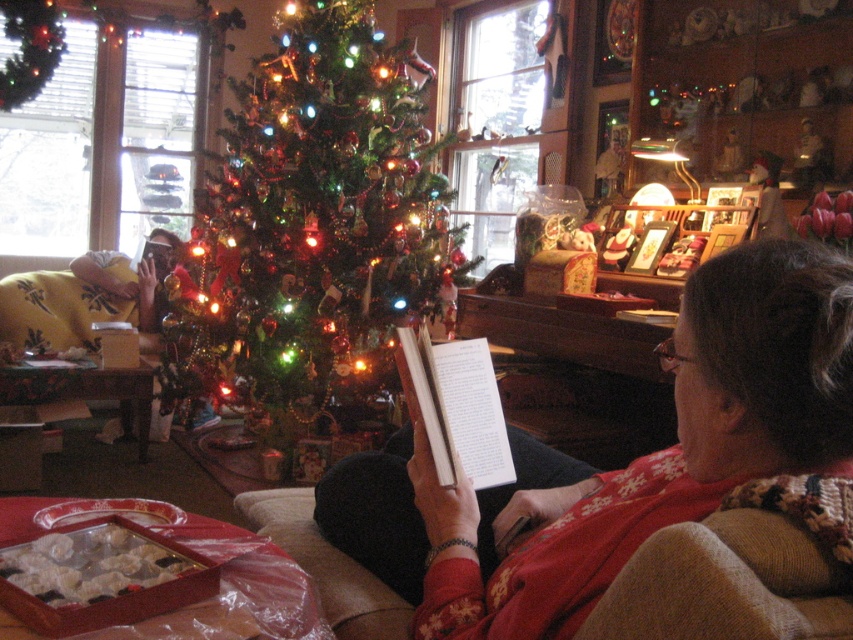
You are planning to place a 1.5 meter tall artificial tree in your living room. The space you have is exactly 1.5 meters tall. You see the shiny green christmas tree at center and the white paper book at center in the image. Based on their heights, can you determine if the artificial tree will fit in your space?

The shiny green christmas tree at center is taller than the white paper book at center. Since the artificial tree you want to place is 1.5 meters tall and the space is exactly 1.5 meters, you need to ensure the tree is no taller than the space. However, without knowing the exact height of the shiny green christmas tree at center, it is impossible to determine if it will fit. Please measure the actual height of the tree before placing it.

You are a guest at this holiday gathering and want to take a photo of both the red sweater at center and the shiny green christmas tree at center. Which object should you focus on first if you want to capture both in the same frame without moving your camera?

You should focus on the shiny green christmas tree at center first because it is larger than the red sweater at center, allowing it to fit better in the frame while still capturing the smaller red sweater at center.